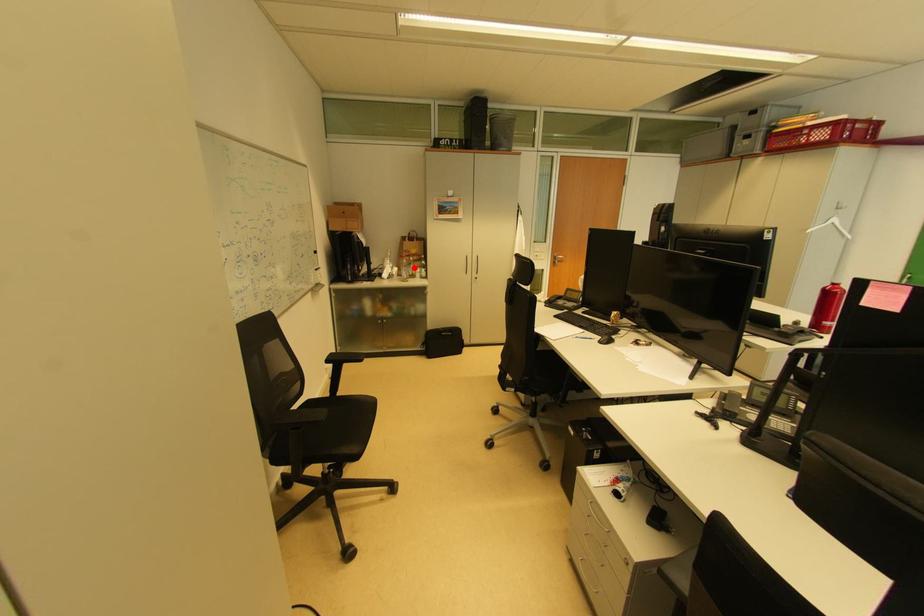
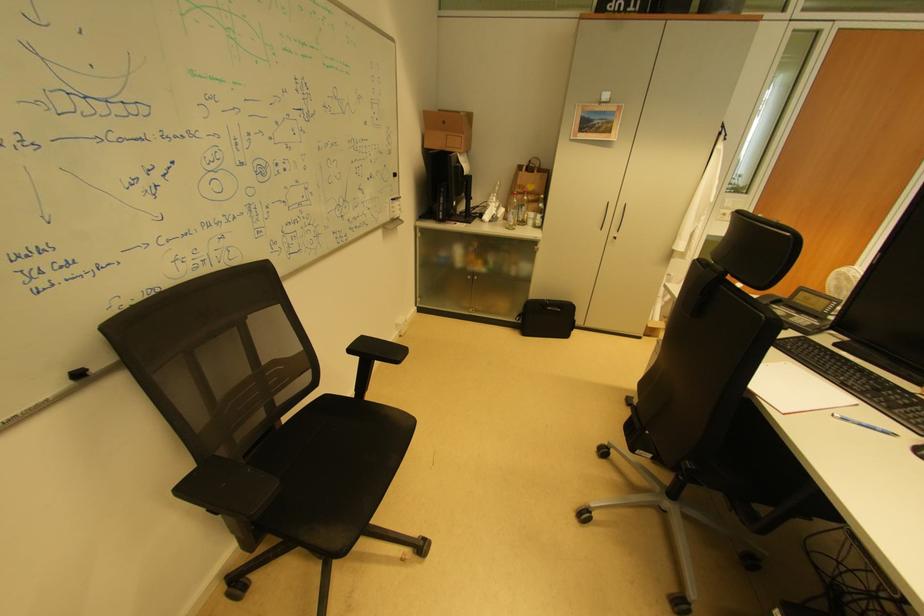
The point at the highlighted location is marked in the first image. Where is the corresponding point in the second image?

(523, 209)